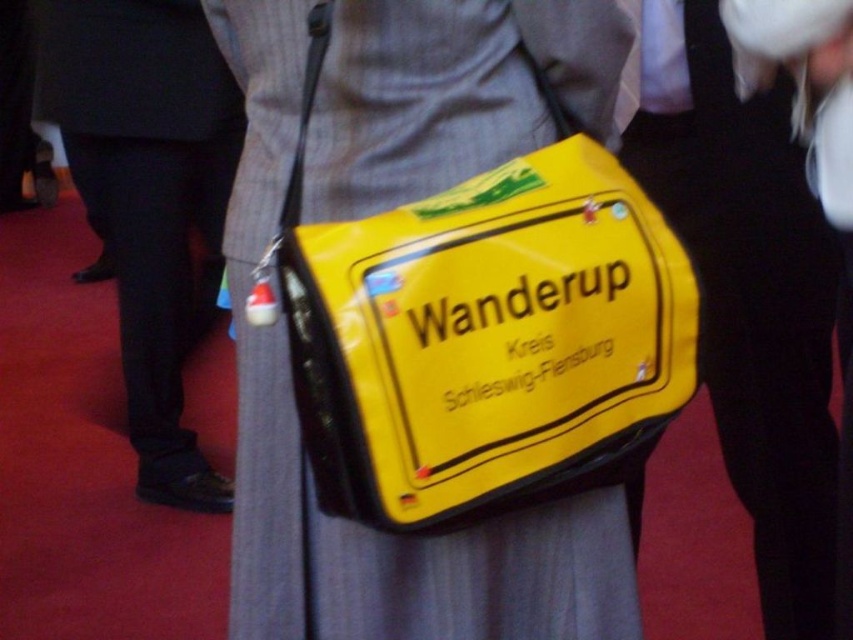
Question: Among these objects, which one is nearest to the camera?

Choices:
 (A) black leather pants at left
 (B) matte black bag at center

Answer: (B)

Question: Where is yellow matte bag at center located in relation to matte black bag at center in the image?

Choices:
 (A) left
 (B) right

Answer: (A)

Question: Is matte black bag at center smaller than black leather pants at left?

Choices:
 (A) no
 (B) yes

Answer: (B)

Question: Which point is closer to the camera?

Choices:
 (A) (583, 92)
 (B) (776, 440)

Answer: (A)

Question: Does matte black bag at center appear under black leather pants at left?

Choices:
 (A) no
 (B) yes

Answer: (B)

Question: Which is nearer to the black leather pants at left?

Choices:
 (A) matte black bag at center
 (B) yellow matte bag at center

Answer: (B)